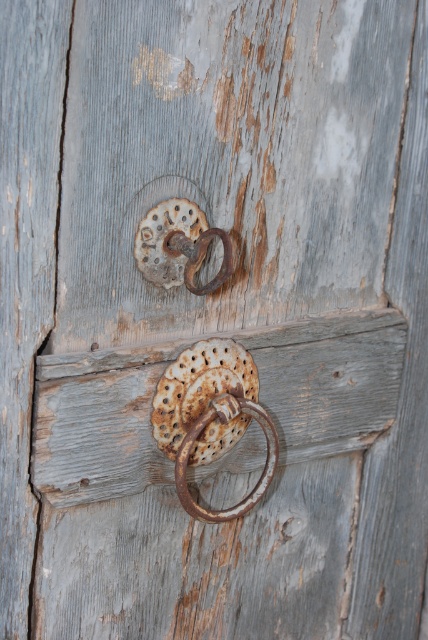
You are trying to open the old wooden door. You see a rusty metal door handle at center and a rusty metal ring at center. Which one should you use to open the door?

The rusty metal door handle at center is below the rusty metal ring at center, so you should use the rusty metal door handle at center to open the door.

You are a painter standing 30 inches away from the rusty metal door handle at center. You want to paint it but need to be at least 36 inches away to ensure proper spraying. Should you move closer or farther away?

The rusty metal door handle at center and viewer are 32.13 inches apart from each other. Since you are currently 30 inches away, you need to move farther away to reach the required 36 inches distance for proper spraying.